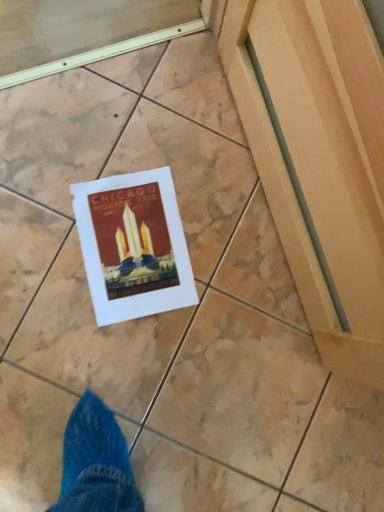
Find the location of a particular element. This screenshot has height=512, width=384. empty space that is ontop of matte paper postcard at center is located at coordinates (131, 245).